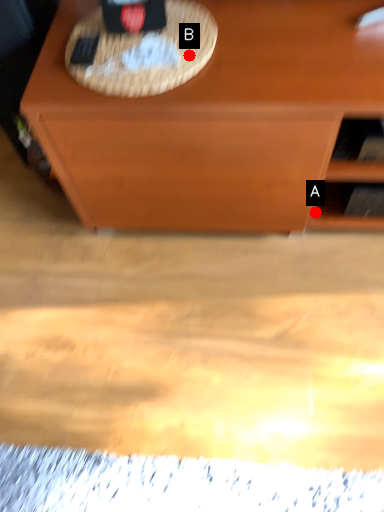
Question: Two points are circled on the image, labeled by A and B beside each circle. Which point is closer to the camera?

Choices:
 (A) A is closer
 (B) B is closer

Answer: (B)